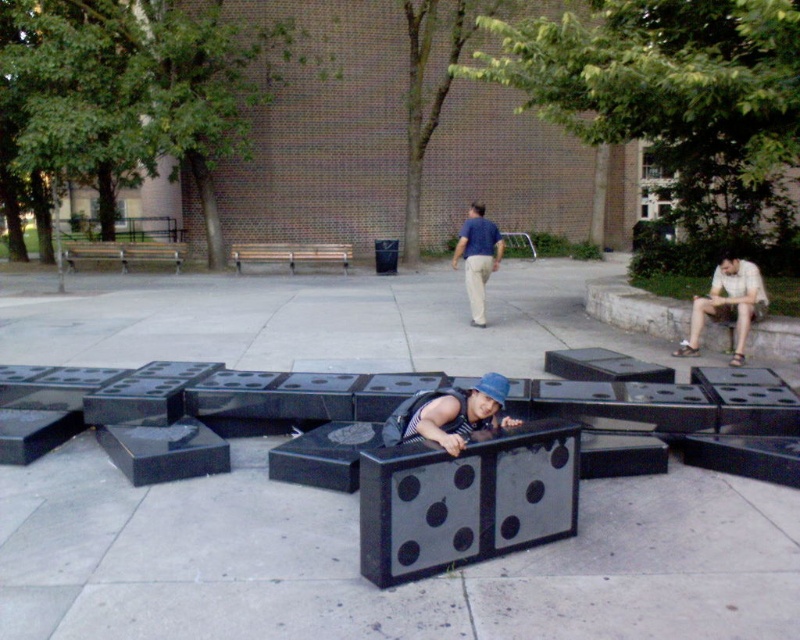
Consider the image. Who is lower down, light beige sandal at right or matte blue shirt at center?

light beige sandal at right

What do you see at coordinates (728, 305) in the screenshot? This screenshot has height=640, width=800. I see `light beige sandal at right` at bounding box center [728, 305].

Where is `light beige sandal at right`? This screenshot has width=800, height=640. light beige sandal at right is located at coordinates (728, 305).

Is matte blue hat at center shorter than wooden bench at left?

Yes.

Does matte blue hat at center appear on the right side of wooden bench at left?

Correct, you'll find matte blue hat at center to the right of wooden bench at left.

Which is in front, point (482, 394) or point (172, 260)?

Positioned in front is point (482, 394).

This screenshot has height=640, width=800. Find the location of `matte blue hat at center`. matte blue hat at center is located at coordinates (450, 413).

Who is lower down, matte blue hat at center or matte blue shirt at center?

matte blue hat at center

Is matte blue hat at center shorter than matte blue shirt at center?

Yes.

Who is more forward, (462, 445) or (496, 240)?

Point (462, 445) is in front.

Image resolution: width=800 pixels, height=640 pixels. Find the location of `matte blue hat at center`. matte blue hat at center is located at coordinates (450, 413).